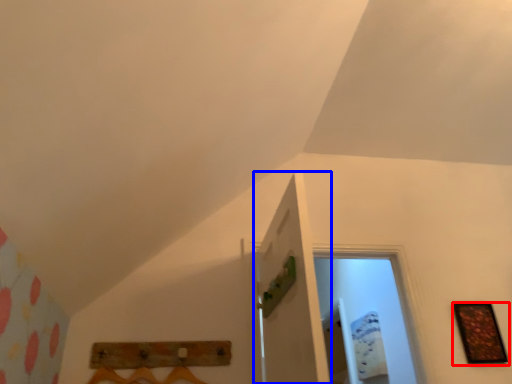
Question: Which of the following is the farthest to the observer, picture frame (highlighted by a red box) or door (highlighted by a blue box)?

Choices:
 (A) picture frame
 (B) door

Answer: (A)